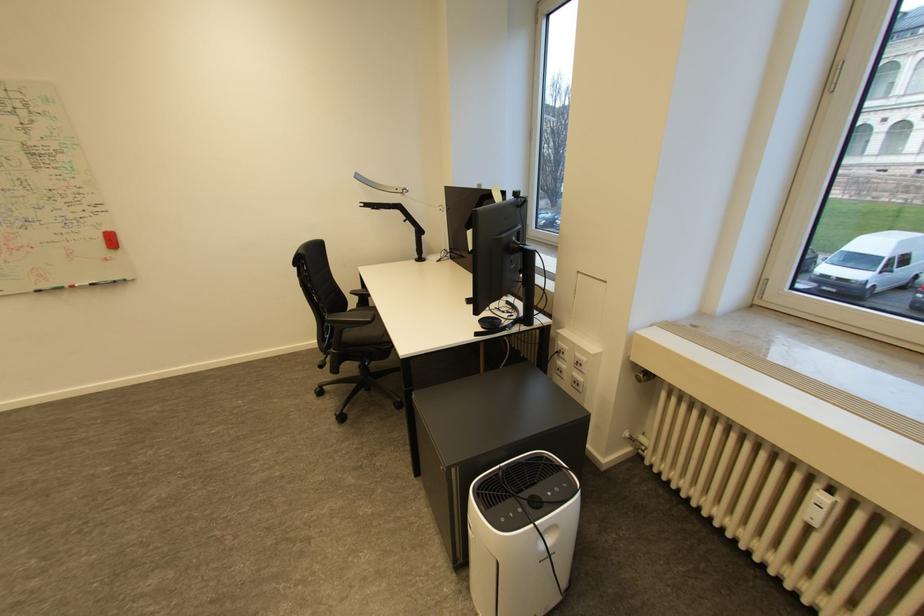
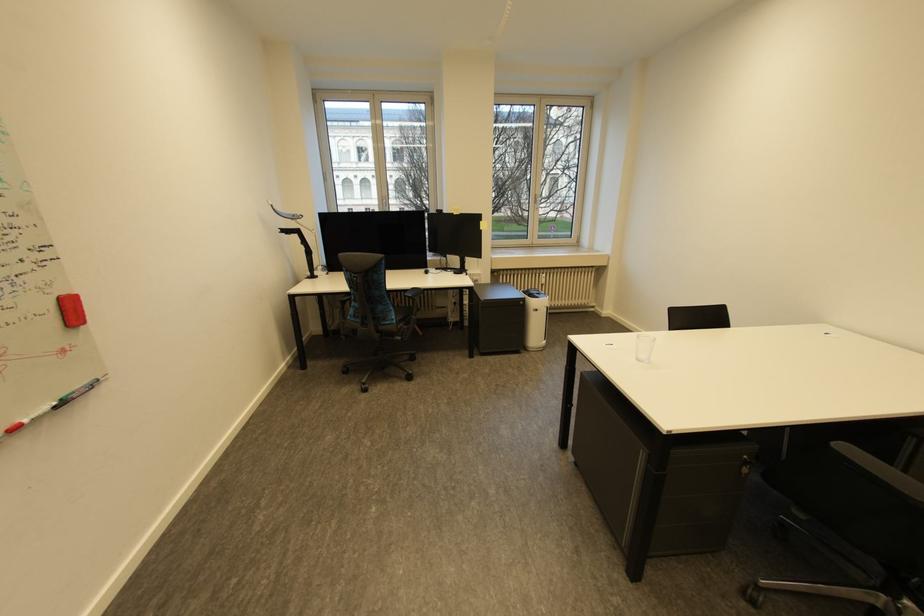
Locate, in the second image, the point that corresponds to (x=74, y=286) in the first image.

(6, 436)